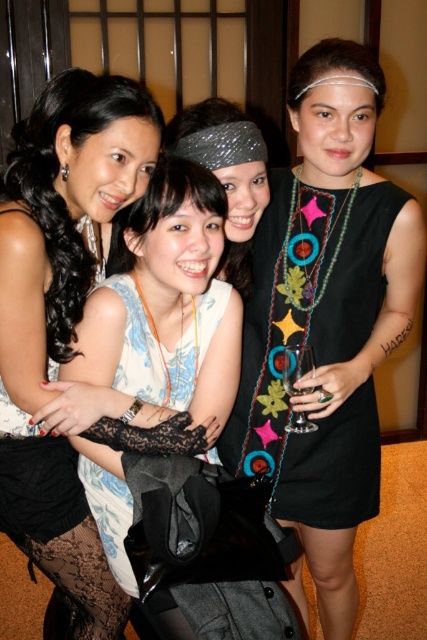
You are standing in the room and want to hand a gift to the person wearing the matte black dress at center and the black fabric dress at center. Which one can you reach first without moving?

The matte black dress at center is closer to the viewer, so you can reach the person wearing the matte black dress at center first.